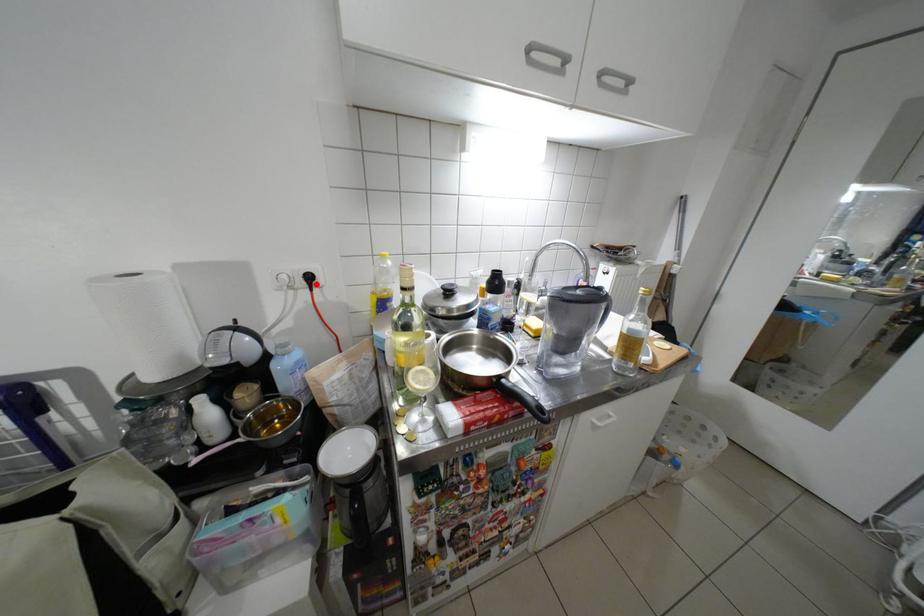
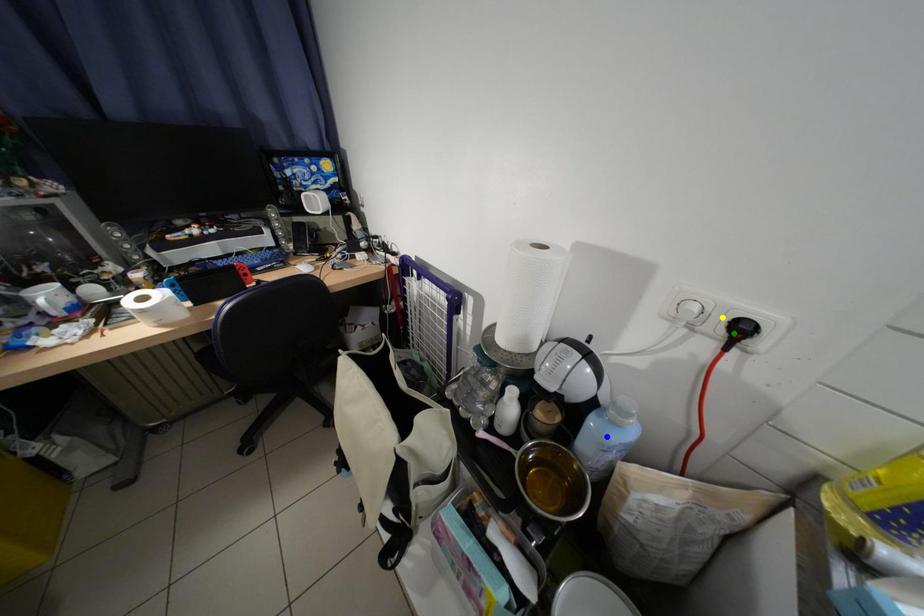
Question: I am providing you with two images of the same scene from different viewpoints. A red point is marked on the first image. You are given multiple points on the second image. Which mark in image 2 goes with the point in image 1?

Choices:
 (A) blue point
 (B) green point
 (C) yellow point

Answer: (B)